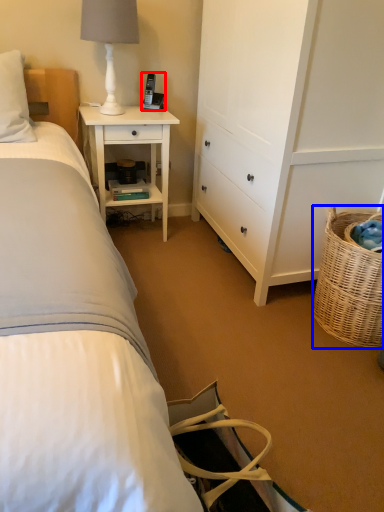
Question: Which object appears farthest to the camera in this image, corded phone (highlighted by a red box) or picnic basket (highlighted by a blue box)?

Choices:
 (A) corded phone
 (B) picnic basket

Answer: (A)